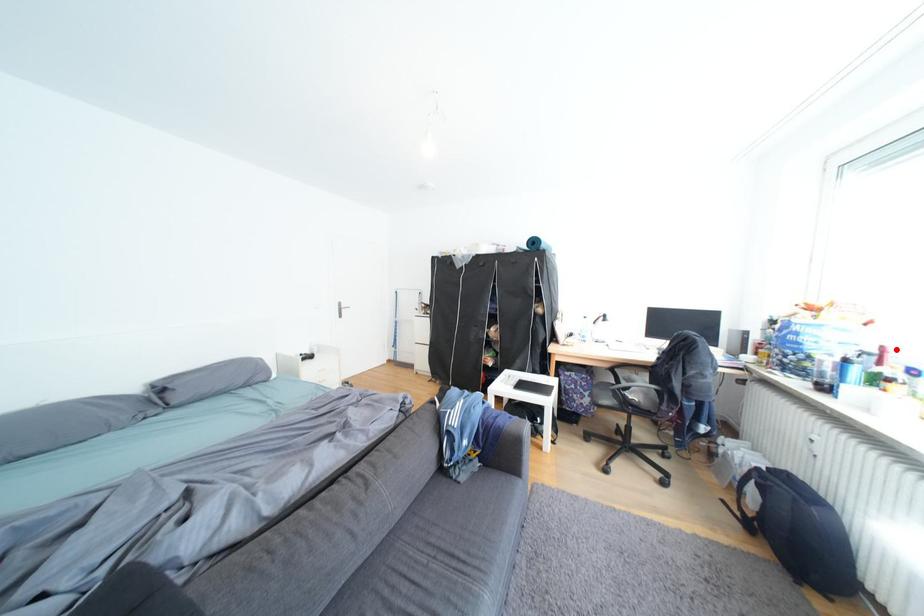
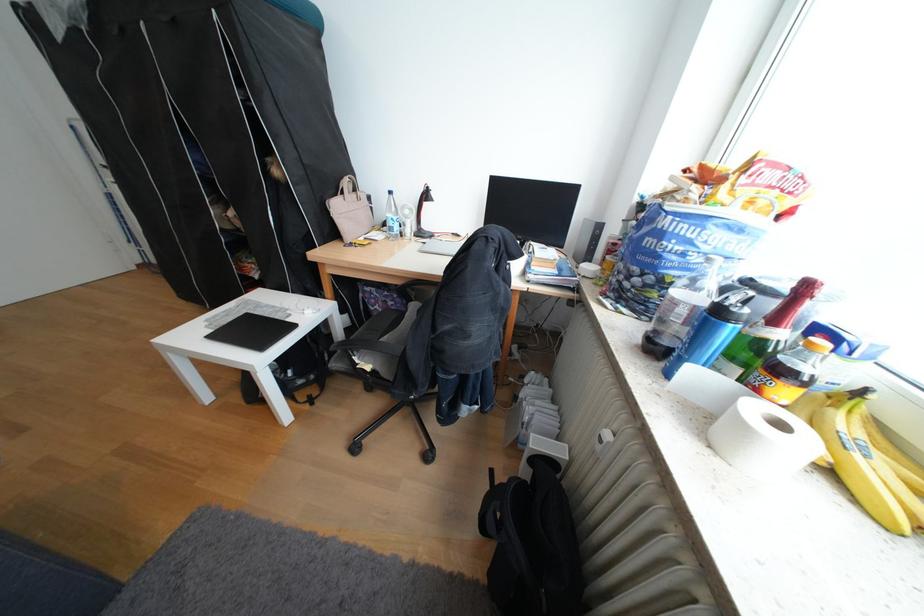
Question: I am providing you with two images of the same scene from different viewpoints. A red point is marked on the first image. Is the red point's position out of view in image 2?

Choices:
 (A) Yes
 (B) No

Answer: (B)